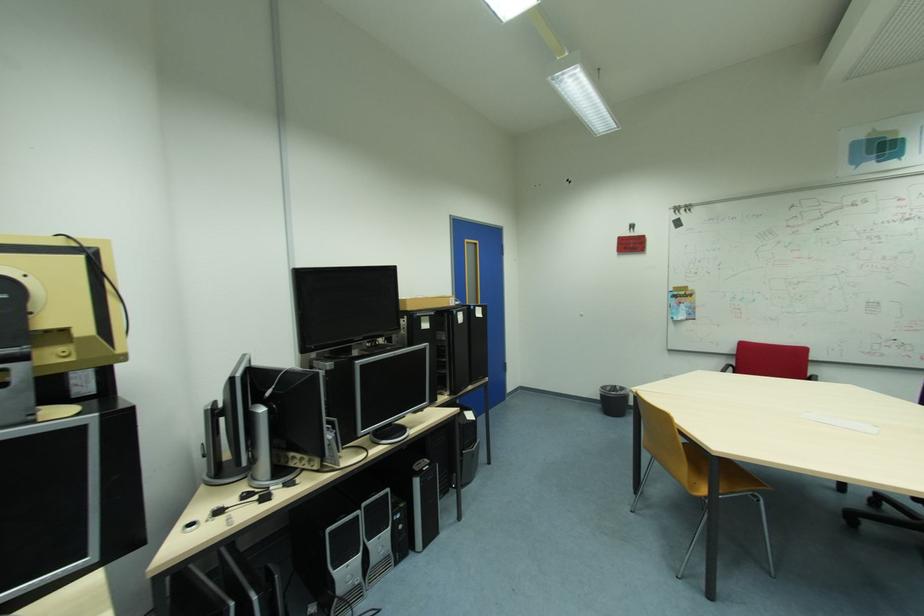
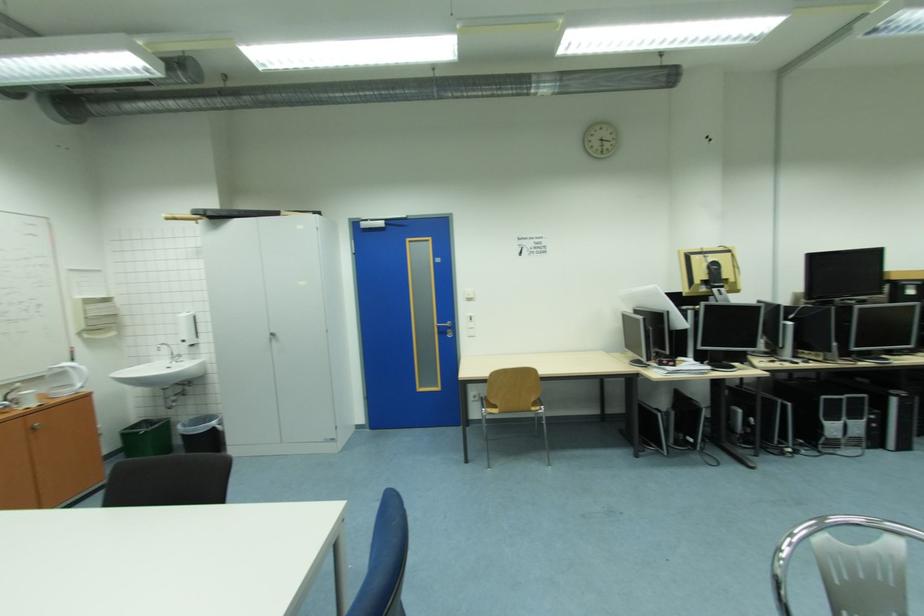
In the second image, find the point that corresponds to point 424,482 in the first image.

(901, 400)